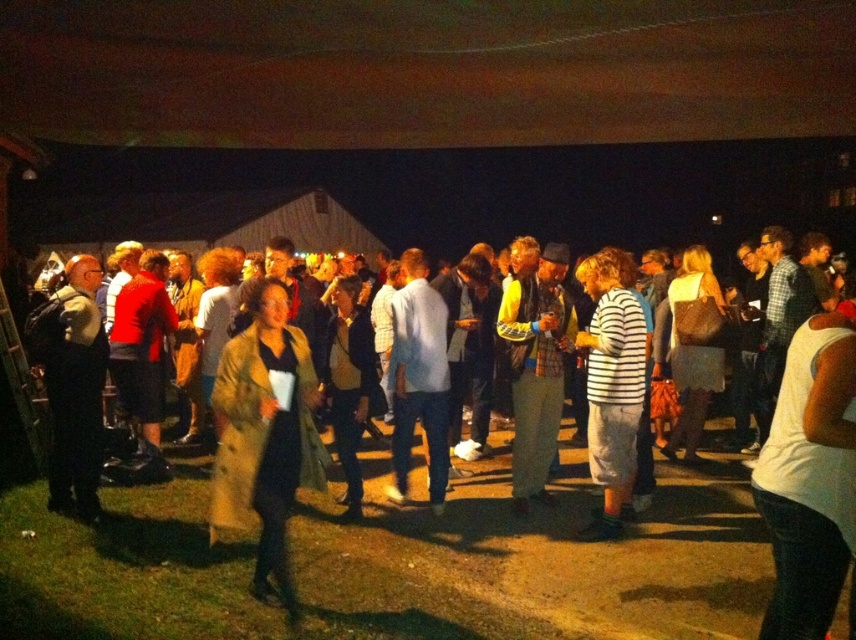
Locate an element on the screen. Image resolution: width=856 pixels, height=640 pixels. yellow-green fabric jacket at center is located at coordinates (536, 369).

Does yellow-green fabric jacket at center appear on the left side of light blue shirt at center?

No, yellow-green fabric jacket at center is not to the left of light blue shirt at center.

Identify the location of yellow-green fabric jacket at center. [x=536, y=369].

Does dark gray jacket at left appear on the left side of white striped shirt at center?

Yes, dark gray jacket at left is to the left of white striped shirt at center.

Is point (51, 298) closer to viewer compared to point (622, 504)?

No, it is not.

The image size is (856, 640). I want to click on dark gray jacket at left, so click(x=72, y=385).

Is tan textured coat at center thinner than white striped shirt at center?

No.

Where is `tan textured coat at center`? The image size is (856, 640). tan textured coat at center is located at coordinates (265, 435).